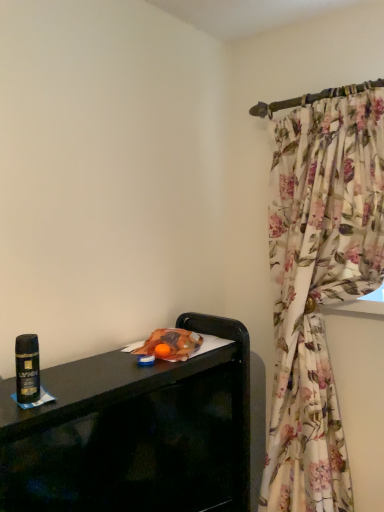
Question: Considering the positions of black glossy tv stand at lower left and shiny black can at left in the image, is black glossy tv stand at lower left wider or thinner than shiny black can at left?

Choices:
 (A) thin
 (B) wide

Answer: (B)

Question: Would you say black glossy tv stand at lower left is to the left or to the right of shiny black can at left in the picture?

Choices:
 (A) left
 (B) right

Answer: (B)

Question: From a real-world perspective, is black glossy tv stand at lower left above or below shiny black can at left?

Choices:
 (A) above
 (B) below

Answer: (B)

Question: In terms of height, does shiny black can at left look taller or shorter compared to black glossy tv stand at lower left?

Choices:
 (A) tall
 (B) short

Answer: (B)

Question: From a real-world perspective, relative to black glossy tv stand at lower left, is shiny black can at left vertically above or below?

Choices:
 (A) above
 (B) below

Answer: (A)

Question: Relative to black glossy tv stand at lower left, is shiny black can at left in front or behind?

Choices:
 (A) front
 (B) behind

Answer: (A)

Question: Is point (18, 361) positioned closer to the camera than point (142, 501)?

Choices:
 (A) closer
 (B) farther

Answer: (A)